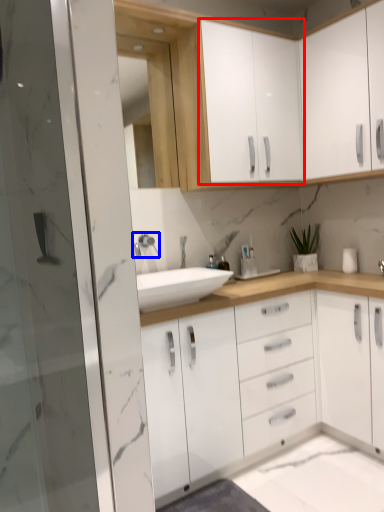
Question: Which of the following is the farthest to the observer, cabinetry (highlighted by a red box) or tap (highlighted by a blue box)?

Choices:
 (A) cabinetry
 (B) tap

Answer: (B)